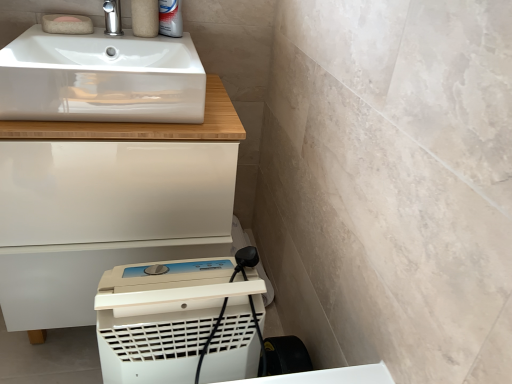
Question: Does white plastic dehumidifier at lower center turn towards polished chrome tap at upper left?

Choices:
 (A) no
 (B) yes

Answer: (A)

Question: From a real-world perspective, is white plastic dehumidifier at lower center positioned under polished chrome tap at upper left based on gravity?

Choices:
 (A) yes
 (B) no

Answer: (A)

Question: Considering the relative sizes of white plastic dehumidifier at lower center and polished chrome tap at upper left in the image provided, is white plastic dehumidifier at lower center taller than polished chrome tap at upper left?

Choices:
 (A) no
 (B) yes

Answer: (B)

Question: Considering the relative sizes of white plastic dehumidifier at lower center and polished chrome tap at upper left in the image provided, is white plastic dehumidifier at lower center thinner than polished chrome tap at upper left?

Choices:
 (A) no
 (B) yes

Answer: (A)

Question: Is white plastic dehumidifier at lower center wider than polished chrome tap at upper left?

Choices:
 (A) no
 (B) yes

Answer: (B)

Question: Is polished chrome tap at upper left at the back of white plastic dehumidifier at lower center?

Choices:
 (A) yes
 (B) no

Answer: (B)

Question: Is pink felt soap at upper left, which is the 2th soap in back-to-front order, positioned behind white glossy cabinet at lower left?

Choices:
 (A) no
 (B) yes

Answer: (B)

Question: Considering the relative positions of pink felt soap at upper left, placed as the first soap when sorted from front to back, and white glossy cabinet at lower left in the image provided, is pink felt soap at upper left, placed as the first soap when sorted from front to back, to the right of white glossy cabinet at lower left from the viewer's perspective?

Choices:
 (A) yes
 (B) no

Answer: (B)

Question: Considering the relative sizes of pink felt soap at upper left, placed as the first soap when sorted from front to back, and white glossy cabinet at lower left in the image provided, is pink felt soap at upper left, placed as the first soap when sorted from front to back, bigger than white glossy cabinet at lower left?

Choices:
 (A) yes
 (B) no

Answer: (B)

Question: From a real-world perspective, is pink felt soap at upper left, placed as the first soap when sorted from front to back, positioned under white glossy cabinet at lower left based on gravity?

Choices:
 (A) yes
 (B) no

Answer: (B)

Question: Is pink felt soap at upper left, placed as the first soap when sorted from front to back, closer to the viewer compared to white glossy cabinet at lower left?

Choices:
 (A) yes
 (B) no

Answer: (B)

Question: Is polished chrome tap at upper left wider than white glossy sink at upper left?

Choices:
 (A) no
 (B) yes

Answer: (A)